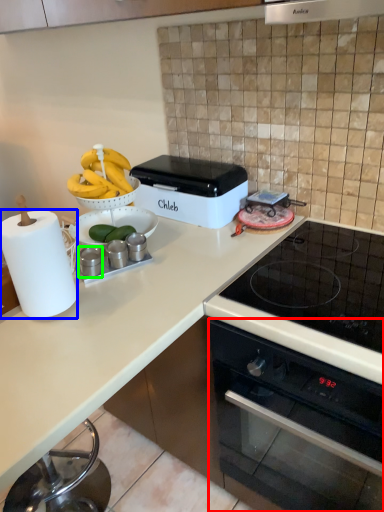
Question: Which object is positioned closest to oven (highlighted by a red box)? Select from paper towel (highlighted by a blue box) and appliance (highlighted by a green box).

Choices:
 (A) paper towel
 (B) appliance

Answer: (A)